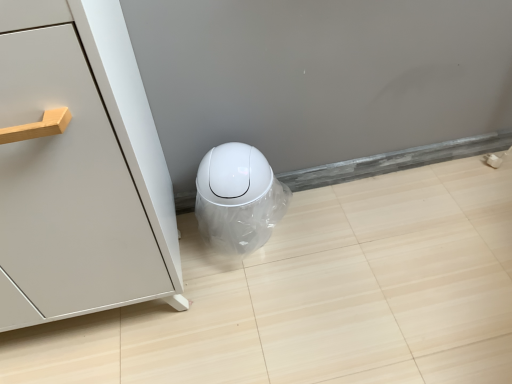
Where is `vacant space that is to the left of white glossy trash can at lower center`? This screenshot has width=512, height=384. vacant space that is to the left of white glossy trash can at lower center is located at coordinates (189, 242).